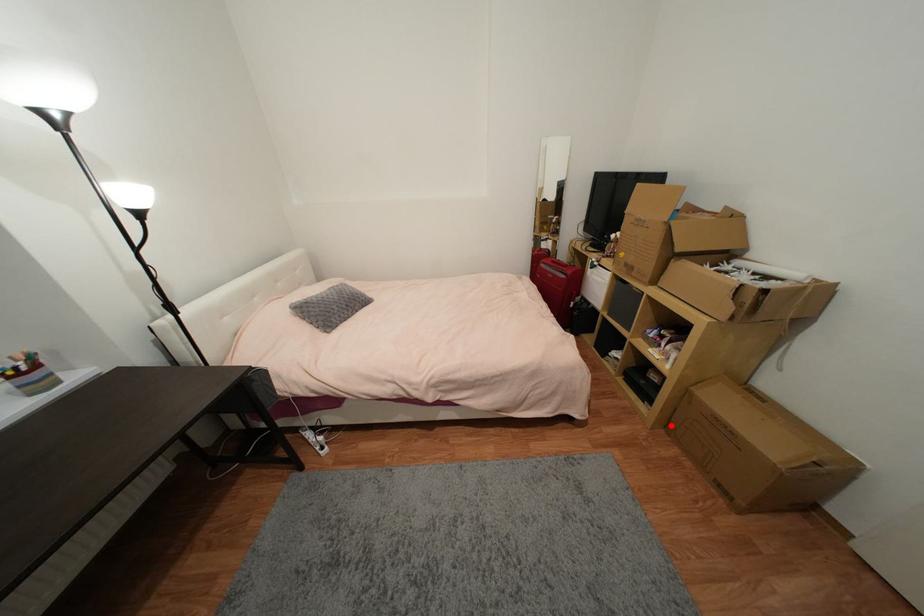
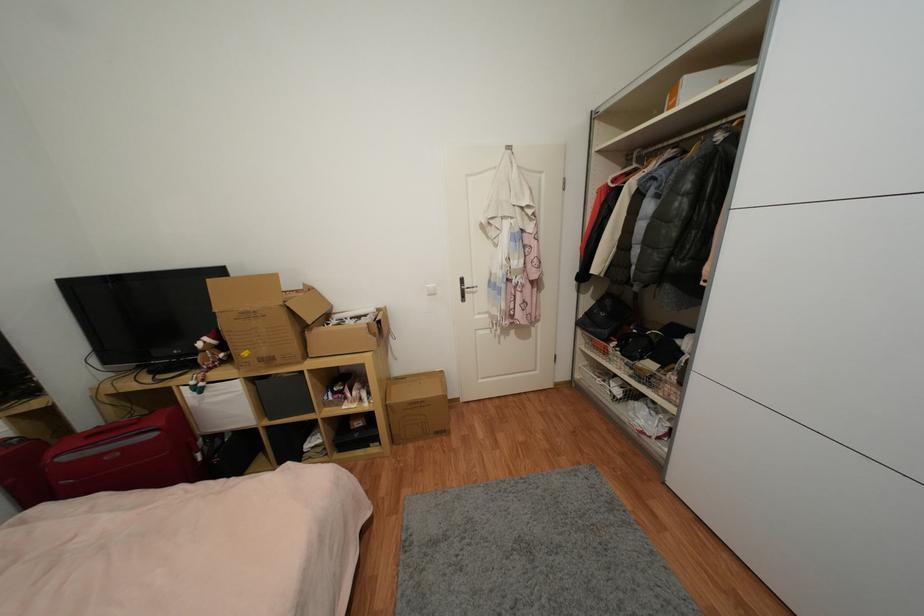
Question: I am providing you with two images of the same scene from different viewpoints. A red point is shown in image1. For the corresponding object point in image2, is it positioned nearer or farther from the camera?

Choices:
 (A) Nearer
 (B) Farther

Answer: (B)